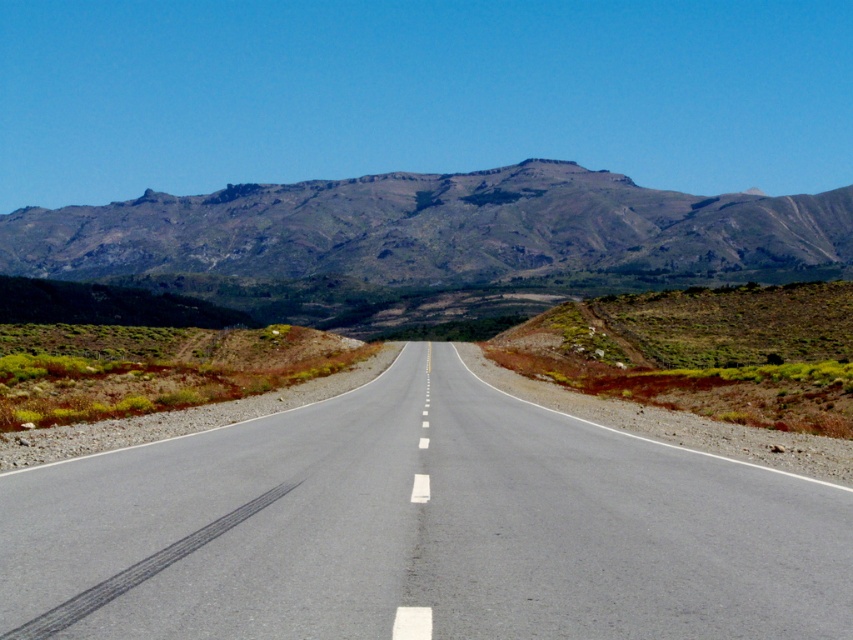
Question: Which point is closer to the camera?

Choices:
 (A) gray rocky mountain range at upper center
 (B) asphalt road at center

Answer: (B)

Question: Which object appears closest to the camera in this image?

Choices:
 (A) gray rocky mountain range at upper center
 (B) asphalt road at center

Answer: (B)

Question: Which point appears farthest from the camera in this image?

Choices:
 (A) (561, 429)
 (B) (370, 248)

Answer: (B)

Question: Is asphalt road at center below gray rocky mountain range at upper center?

Choices:
 (A) yes
 (B) no

Answer: (A)

Question: Can you confirm if asphalt road at center is thinner than gray rocky mountain range at upper center?

Choices:
 (A) no
 (B) yes

Answer: (B)

Question: Can you confirm if asphalt road at center is bigger than gray rocky mountain range at upper center?

Choices:
 (A) no
 (B) yes

Answer: (A)